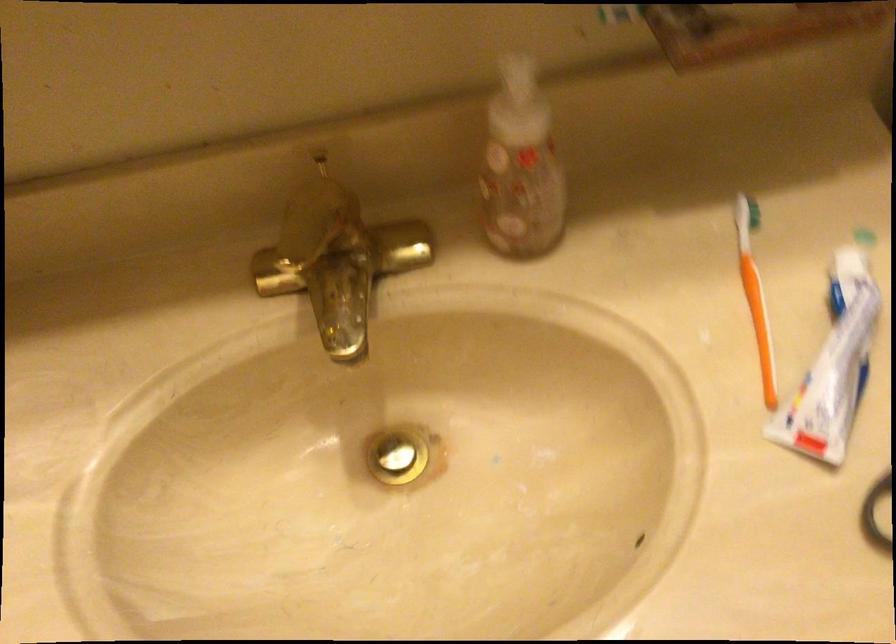
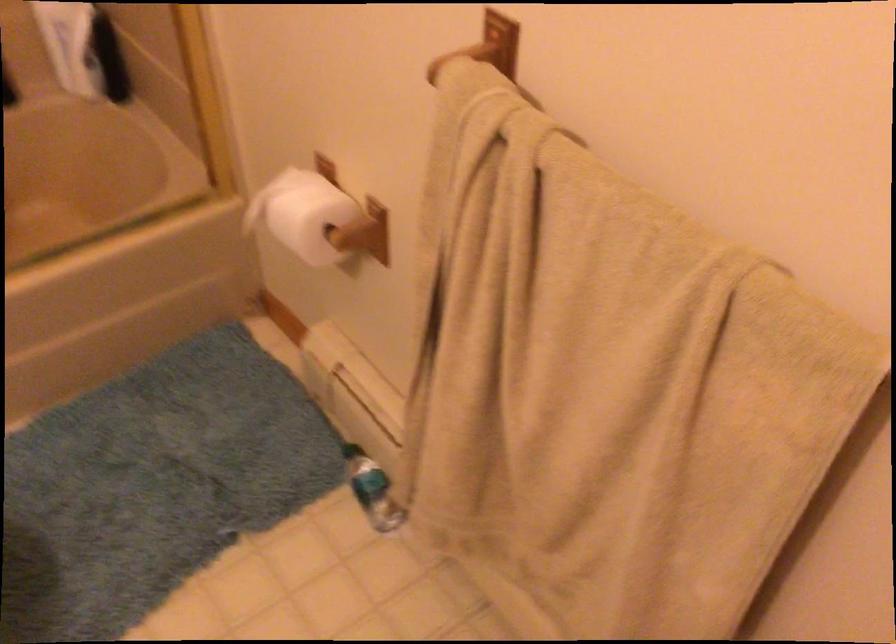
First-person continuous shooting, in which direction is the camera rotating?

The rotation direction of the camera is right-down.